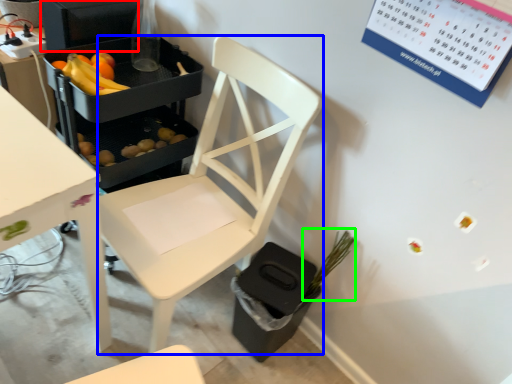
Question: Based on their relative distances, which object is nearer to appliance (highlighted by a red box)? Choose from chair (highlighted by a blue box) and plant (highlighted by a green box).

Choices:
 (A) chair
 (B) plant

Answer: (A)